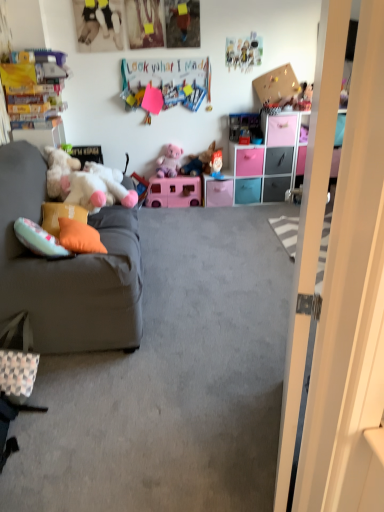
This screenshot has width=384, height=512. I want to click on vacant space that's between white glossy door at right and checkered fabric bag at lower left, so click(152, 419).